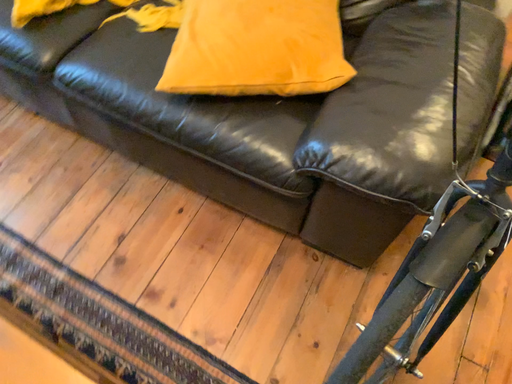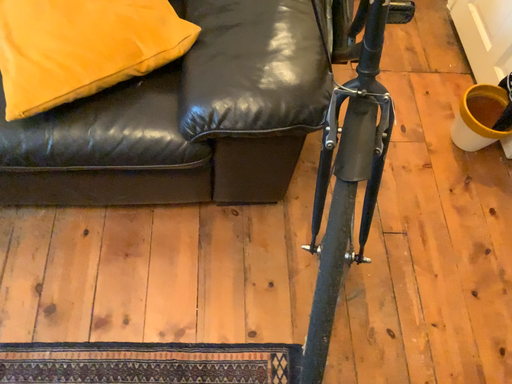
Question: Which way did the camera rotate in the video?

Choices:
 (A) rotated left
 (B) rotated right

Answer: (B)